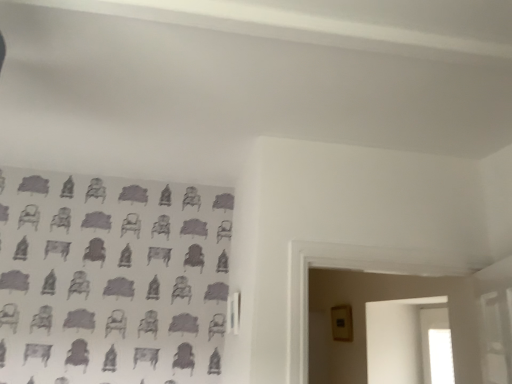
This screenshot has height=384, width=512. What do you see at coordinates (426, 333) in the screenshot?
I see `transparent glass window at right` at bounding box center [426, 333].

This screenshot has height=384, width=512. In order to click on transparent glass window at right in this screenshot , I will do `click(426, 333)`.

This screenshot has height=384, width=512. I want to click on transparent glass window at right, so click(426, 333).